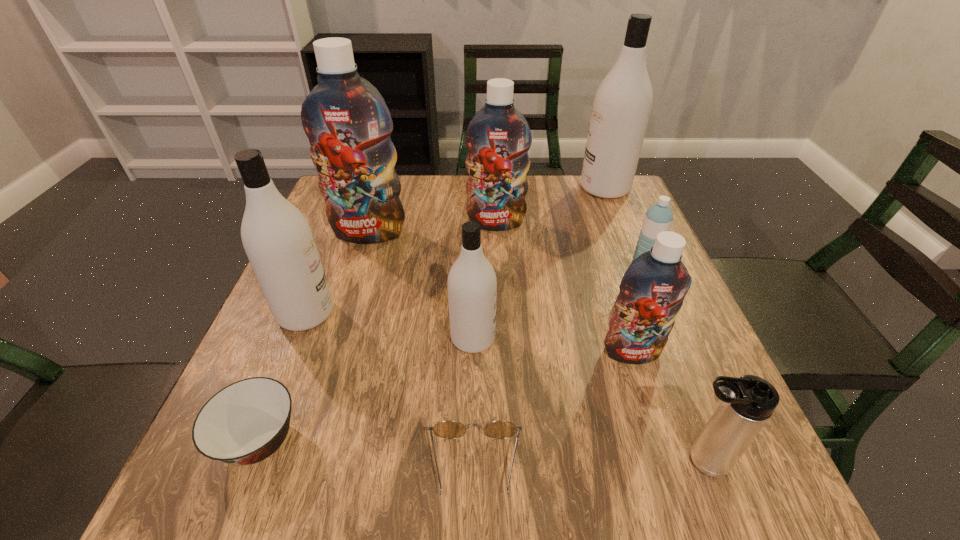
Find the location of `free space at the far right corner of the desktop`. free space at the far right corner of the desktop is located at coordinates (635, 204).

In the image, there is a desktop. Where is `free space at the near right corner`? The height and width of the screenshot is (540, 960). free space at the near right corner is located at coordinates (709, 499).

Identify the location of free point between the leftmost blue shampoo and the water bottle. (505, 252).

Identify the location of free space between the second shortest object and the leftmost white shampoo. Image resolution: width=960 pixels, height=540 pixels. (283, 377).

Where is `blank region between the thermos bottle and the blue water bottle`? The height and width of the screenshot is (540, 960). blank region between the thermos bottle and the blue water bottle is located at coordinates (671, 367).

Locate an element on the screen. The height and width of the screenshot is (540, 960). free space that is in between the second white shampoo from right to left and the nearest blue shampoo is located at coordinates (553, 345).

The height and width of the screenshot is (540, 960). What are the coordinates of `free space between the shortest object and the thermos bottle` in the screenshot? It's located at (588, 464).

Locate an element on the screen. The image size is (960, 540). vacant area between the leftmost blue shampoo and the smallest white shampoo is located at coordinates (421, 285).

Identify the location of vacant space that is in between the thermos bottle and the blue water bottle. The height and width of the screenshot is (540, 960). click(671, 367).

I want to click on object that ranks as the closest to the ninth tallest object, so click(277, 238).